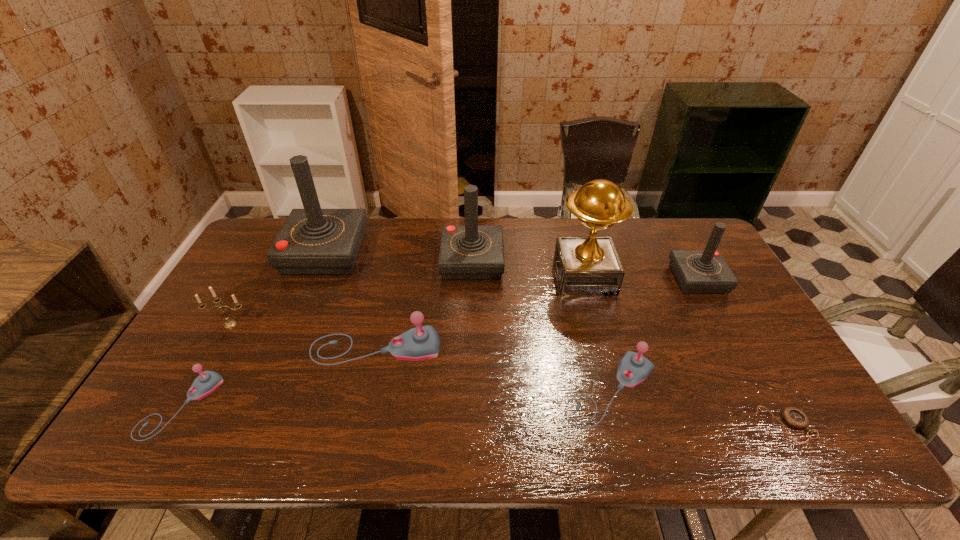
The image size is (960, 540). What are the coordinates of `vacant space at the right edge` in the screenshot? It's located at (762, 337).

The image size is (960, 540). Find the location of `vacant space at the near left corner of the desktop`. vacant space at the near left corner of the desktop is located at coordinates (188, 428).

Where is `free space at the far right corner`? This screenshot has height=540, width=960. free space at the far right corner is located at coordinates (666, 238).

Where is `blank region between the second smallest red joystick and the fourth tallest joystick`? blank region between the second smallest red joystick and the fourth tallest joystick is located at coordinates (424, 305).

I want to click on empty location between the third shortest joystick and the gold award, so click(480, 312).

You are a GUI agent. You are given a task and a screenshot of the screen. Output one action in this format:
    pyautogui.click(x=<x>, y=<y>)
    Task: Click on the vacant area that lies between the metallic candle and the shortest joystick
    The width and height of the screenshot is (960, 540).
    Given the screenshot: What is the action you would take?
    pyautogui.click(x=205, y=365)

Find the location of a particular element. Image resolution: width=960 pixels, height=540 pixels. empty space that is in between the metallic candle and the biggest gray joystick is located at coordinates (303, 336).

The width and height of the screenshot is (960, 540). What are the coordinates of `empty space that is in between the leftmost red joystick and the pocket watch` in the screenshot? It's located at (556, 339).

This screenshot has width=960, height=540. I want to click on empty location between the award and the biggest gray joystick, so click(480, 312).

What are the coordinates of `empty space between the shortest object and the smallest red joystick` in the screenshot? It's located at (742, 352).